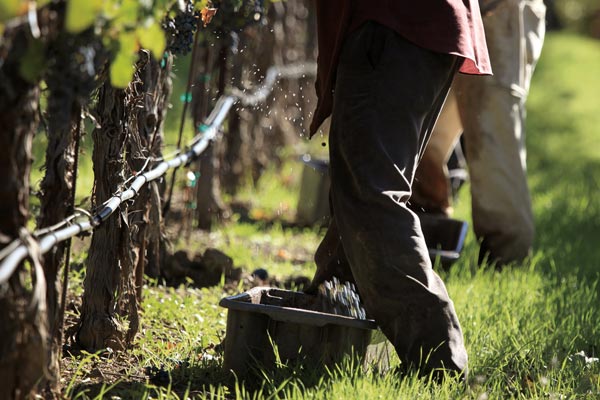
Where is `bin`? bin is located at coordinates (314, 343).